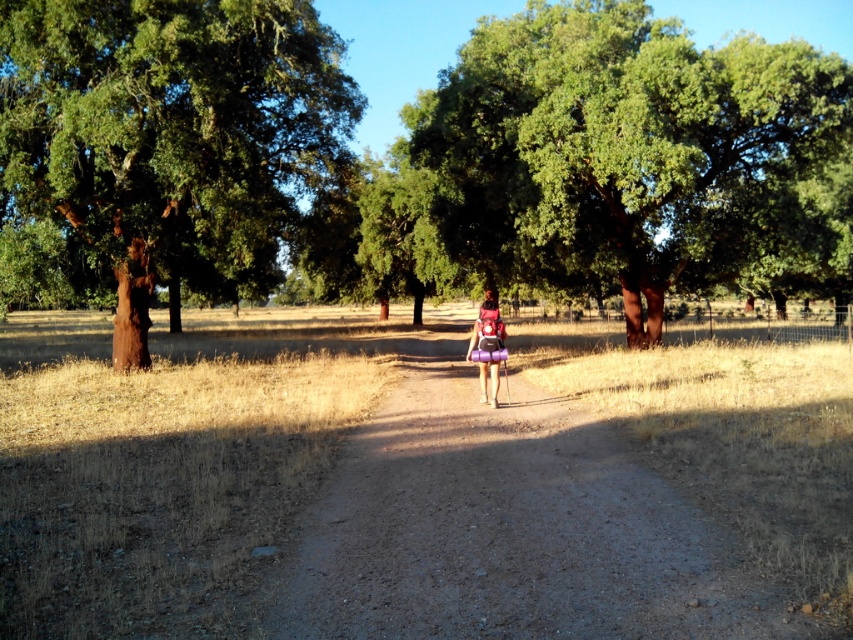
You are standing on the dirt path and want to place a small bench between the brown bark tree at left and the purple fabric backpack at center. Which object should the bench be closer to?

The bench should be placed closer to the purple fabric backpack at center because the brown bark tree at left is further away from the viewer, meaning the backpack is nearer. The bench needs to be positioned between them, so it must be closer to the closer object to maintain the spatial relationship.

From the picture: You are standing at the point labeled point (660, 548) and want to walk towards the point labeled point (325, 147). Which direction should you face to move directly towards it?

You should face away from the camera because point (660, 548) is closer to the camera than point (325, 147), meaning it is physically behind you in the scene.

You are planning to set up a tent for camping. You see the dirt path at center and the brown bark tree at left. Which location would provide more shade from the sun?

The brown bark tree at left would provide more shade because the dirt path at center is positioned under it, meaning the tree is overhead and casting a shadow over the path.